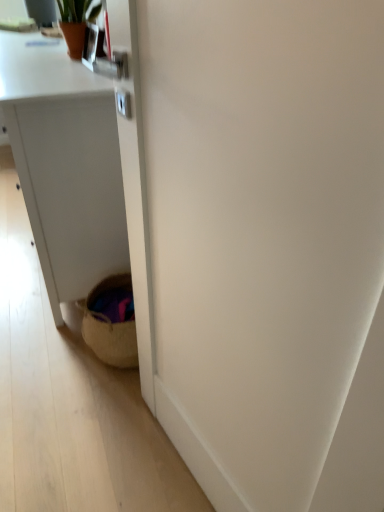
What is the approximate width of white matte desk at lower left?

white matte desk at lower left is 21.98 inches in width.

The image size is (384, 512). What do you see at coordinates (73, 24) in the screenshot? I see `terracotta pot at upper left` at bounding box center [73, 24].

You are a GUI agent. You are given a task and a screenshot of the screen. Output one action in this format:
    pyautogui.click(x=<x>, y=<y>)
    Task: Click on the woven basket at lower left
    The height and width of the screenshot is (512, 384).
    Given the screenshot: What is the action you would take?
    pyautogui.click(x=268, y=246)

From the image's perspective, between terracotta pot at upper left and white matte desk at lower left, who is located below?

white matte desk at lower left.

In terms of height, does terracotta pot at upper left look taller or shorter compared to white matte desk at lower left?

In the image, terracotta pot at upper left appears to be shorter than white matte desk at lower left.

Is there a large distance between terracotta pot at upper left and white matte desk at lower left?

That's not correct — terracotta pot at upper left is a little close to white matte desk at lower left.

From a real-world perspective, which object stands above the other?

terracotta pot at upper left is physically above.

Which is behind, terracotta pot at upper left or woven basket at lower left?

terracotta pot at upper left is behind.

From a real-world perspective, is terracotta pot at upper left located beneath woven basket at lower left?

No, from a real-world perspective, terracotta pot at upper left is not under woven basket at lower left.

Consider the image. Is woven basket at lower left surrounded by terracotta pot at upper left?

No, woven basket at lower left is located outside of terracotta pot at upper left.

Is terracotta pot at upper left next to woven basket at lower left?

terracotta pot at upper left and woven basket at lower left are clearly separated.

Considering the sizes of objects woven basket at lower left and terracotta pot at upper left in the image provided, who is thinner, woven basket at lower left or terracotta pot at upper left?

woven basket at lower left.

Is woven basket at lower left bigger or smaller than terracotta pot at upper left?

Considering their sizes, woven basket at lower left takes up more space than terracotta pot at upper left.

Between point (375, 194) and point (74, 3), which one is positioned in front?

Point (375, 194)

Consider the image. From the image's perspective, would you say white matte desk at lower left is positioned over terracotta pot at upper left?

Incorrect, from the image's perspective, white matte desk at lower left is lower than terracotta pot at upper left.

Who is taller, white matte desk at lower left or terracotta pot at upper left?

white matte desk at lower left is taller.

Based on the photo, is white matte desk at lower left oriented away from terracotta pot at upper left?

No, white matte desk at lower left's orientation is not away from terracotta pot at upper left.

Is white matte desk at lower left situated inside terracotta pot at upper left or outside?

white matte desk at lower left is not enclosed by terracotta pot at upper left.

Which object is positioned more to the right, woven basket at lower left or white matte desk at lower left?

woven basket at lower left is more to the right.

Locate an element on the screen. desk on the left of woven basket at lower left is located at coordinates (65, 163).

In terms of width, does woven basket at lower left look wider or thinner when compared to white matte desk at lower left?

Clearly, woven basket at lower left has less width compared to white matte desk at lower left.

In the image, is woven basket at lower left positioned in front of or behind white matte desk at lower left?

Visually, woven basket at lower left is located in front of white matte desk at lower left.

Is white matte desk at lower left not within woven basket at lower left?

white matte desk at lower left is positioned outside woven basket at lower left.

Which is in front, point (96, 178) or point (371, 337)?

The point (371, 337) is in front.

From a real-world perspective, does white matte desk at lower left sit lower than woven basket at lower left?

Correct, in the physical world, white matte desk at lower left is lower than woven basket at lower left.

Is white matte desk at lower left bigger than woven basket at lower left?

Correct, white matte desk at lower left is larger in size than woven basket at lower left.

This screenshot has width=384, height=512. Find the location of `desk located below the terracotta pot at upper left (from the image's perspective)`. desk located below the terracotta pot at upper left (from the image's perspective) is located at coordinates (65, 163).

Image resolution: width=384 pixels, height=512 pixels. I want to click on screen door that appears below the terracotta pot at upper left (from a real-world perspective), so click(x=268, y=246).

Based on their spatial positions, is white matte desk at lower left or terracotta pot at upper left further from woven basket at lower left?

terracotta pot at upper left is further to woven basket at lower left.

Estimate the real-world distances between objects in this image. Which object is further from woven basket at lower left, terracotta pot at upper left or white matte desk at lower left?

Based on the image, terracotta pot at upper left appears to be further to woven basket at lower left.

Which object lies nearer to the anchor point terracotta pot at upper left, woven basket at lower left or white matte desk at lower left?

The object closer to terracotta pot at upper left is white matte desk at lower left.

Consider the image. When comparing their distances from white matte desk at lower left, does woven basket at lower left or terracotta pot at upper left seem closer?

The object closer to white matte desk at lower left is terracotta pot at upper left.

Considering their positions, is white matte desk at lower left positioned further to terracotta pot at upper left than woven basket at lower left?

Based on the image, woven basket at lower left appears to be further to terracotta pot at upper left.

Which object lies nearer to the anchor point white matte desk at lower left, terracotta pot at upper left or woven basket at lower left?

Among the two, terracotta pot at upper left is located nearer to white matte desk at lower left.

I want to click on desk between woven basket at lower left and terracotta pot at upper left from front to back, so click(65, 163).